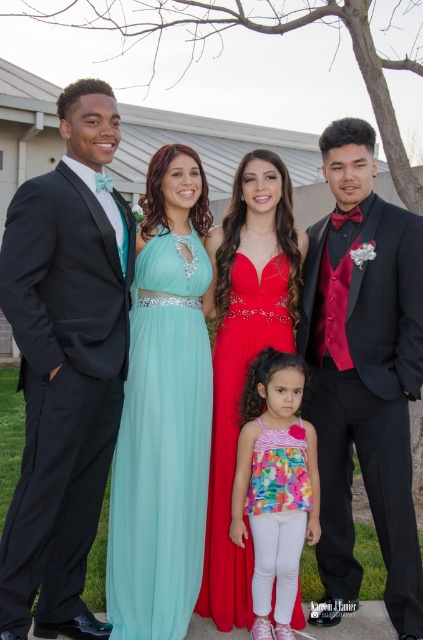
Question: Which object appears closest to the camera in this image?

Choices:
 (A) shiny black suit at left
 (B) shiny red dress at center

Answer: (A)

Question: Which of these objects is positioned farthest from the floral fabric dress at center?

Choices:
 (A) black satin suit at right
 (B) shiny black suit at left
 (C) shiny red dress at center

Answer: (B)

Question: Can you confirm if shiny black suit at left is positioned to the right of floral fabric dress at center?

Choices:
 (A) yes
 (B) no

Answer: (B)

Question: Where is shiny black suit at left located in relation to teal chiffon dress at center in the image?

Choices:
 (A) above
 (B) below

Answer: (A)

Question: Which of the following is the closest to the observer?

Choices:
 (A) (65, 627)
 (B) (404, 266)
 (C) (233, 429)
 (D) (150, 241)

Answer: (A)

Question: Does shiny black suit at left appear over shiny red dress at center?

Choices:
 (A) no
 (B) yes

Answer: (B)